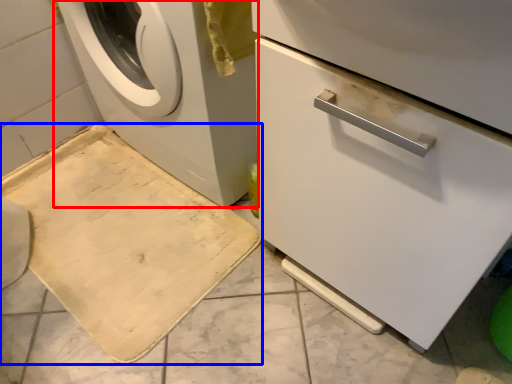
Question: Which point is closer to the camera, washing machine (highlighted by a red box) or bath mat (highlighted by a blue box)?

Choices:
 (A) washing machine
 (B) bath mat

Answer: (A)